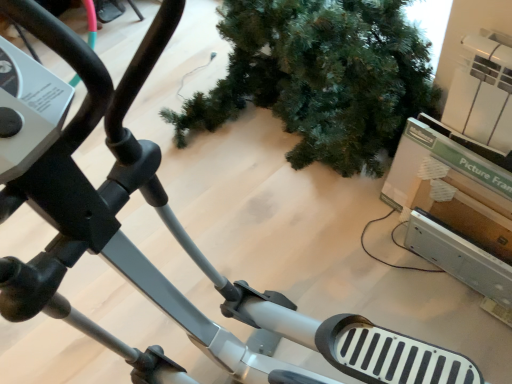
Identify the location of blank area to the left of white plastic wii at lower right. The height and width of the screenshot is (384, 512). (398, 284).